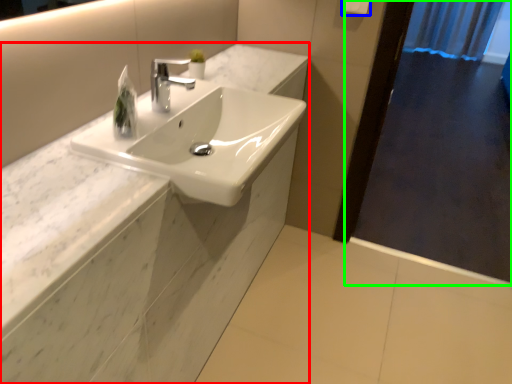
Question: Based on their relative distances, which object is farther from counter (highlighted by a red box)? Choose from towel bar (highlighted by a blue box) and screen door (highlighted by a green box).

Choices:
 (A) towel bar
 (B) screen door

Answer: (B)